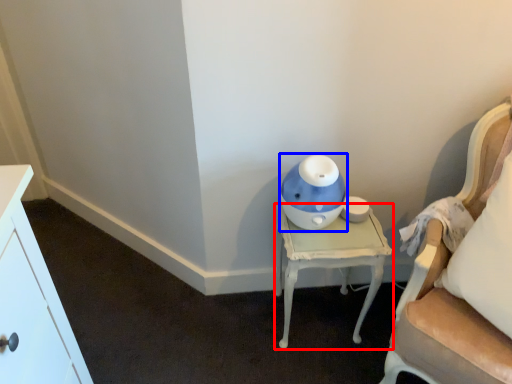
Question: Which object appears closest to the camera in this image, nightstand (highlighted by a red box) or toy (highlighted by a blue box)?

Choices:
 (A) nightstand
 (B) toy

Answer: (B)